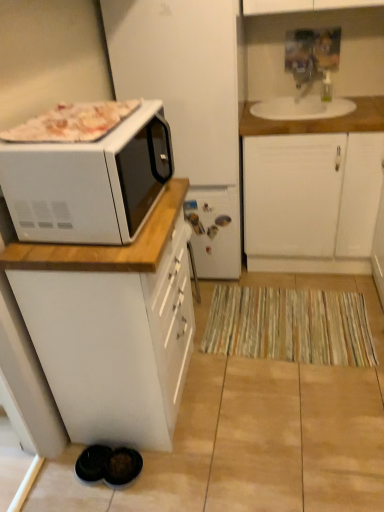
Question: From the image's perspective, is wooden countertop at upper right above or below white glossy microwave at upper left?

Choices:
 (A) below
 (B) above

Answer: (B)

Question: Considering their positions, is wooden countertop at upper right located in front of or behind white glossy microwave at upper left?

Choices:
 (A) front
 (B) behind

Answer: (B)

Question: Estimate the real-world distances between objects in this image. Which object is closer to the wooden countertop at upper right?

Choices:
 (A) white matte cabinet at upper right, the second cabinetry from the front
 (B) white glossy microwave at upper left
 (C) striped fabric mat at lower center
 (D) white matte cabinet at left, acting as the 1th cabinetry starting from the front
 (E) white matte microwave at left

Answer: (A)

Question: Estimate the real-world distances between objects in this image. Which object is farther from the wooden countertop at upper right?

Choices:
 (A) striped fabric mat at lower center
 (B) white matte microwave at left
 (C) white matte cabinet at upper right, the first cabinetry in the back-to-front sequence
 (D) white glossy microwave at upper left
 (E) white matte cabinet at left, positioned as the 2th cabinetry in back-to-front order

Answer: (E)